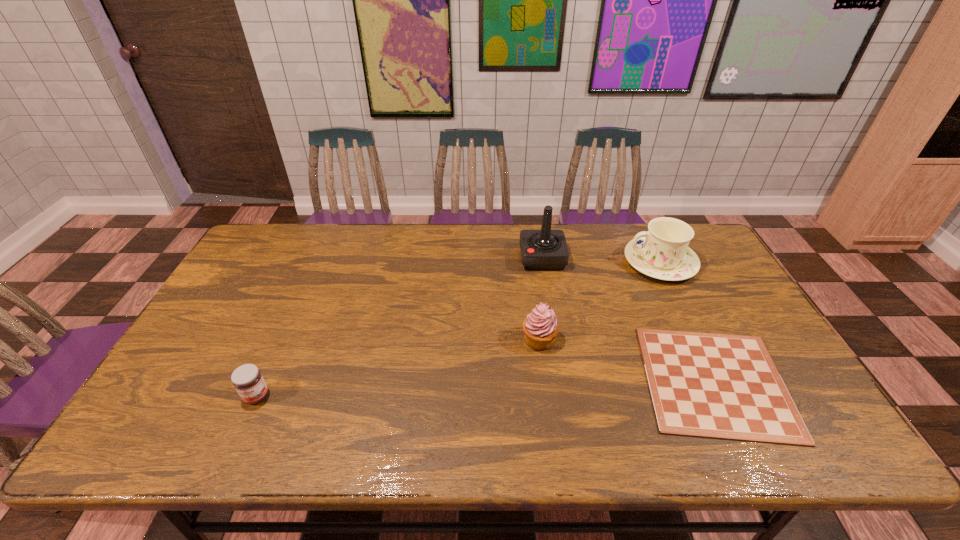
Identify the location of vacant position in the image that satisfies the following two spatial constraints: 1. on the handle side of the chinaware; 2. on the front side of the shortest object. (718, 381).

Image resolution: width=960 pixels, height=540 pixels. In order to click on vacant area in the image that satisfies the following two spatial constraints: 1. on the front-facing side of the shortest object; 2. on the left side of the tallest object in this screenshot , I will do `click(564, 381)`.

I want to click on free space that satisfies the following two spatial constraints: 1. on the front-facing side of the checkerboard; 2. on the left side of the tallest object, so click(564, 381).